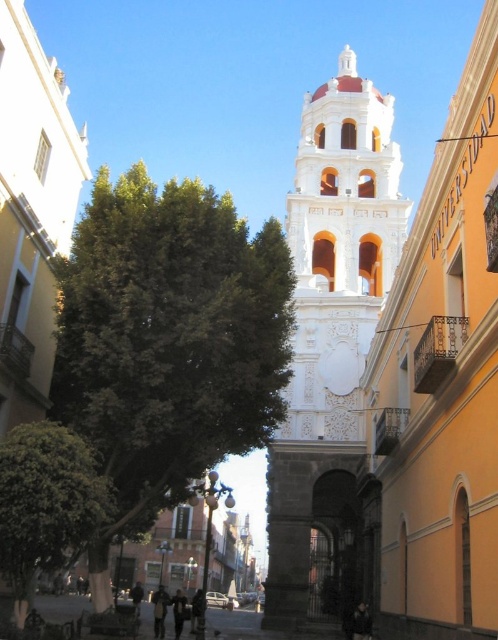
What does the point at coordinates (x=442, y=385) indicate in the image?

The point at coordinates (x=442, y=385) marks the white ornate tower at center.

You are a drone operator trying to capture aerial footage of the bell tower. You have two points marked in the scene for reference. Point A is at coordinates point (175, 634) and Point B is at point (138, 593). Which point should you prioritize for a closer shot to ensure the bell tower remains in focus?

Point A at coordinates point (175, 634) should be prioritized because it is closer to the camera, allowing for a clearer focus on the bell tower.